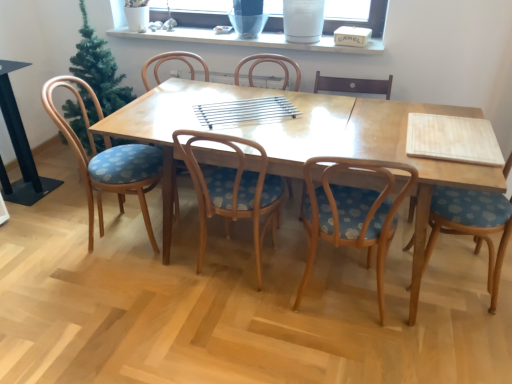
The width and height of the screenshot is (512, 384). I want to click on free location to the right of wooden chair with blue floral cushion at center, acting as the 5th chair starting from the left, so click(442, 325).